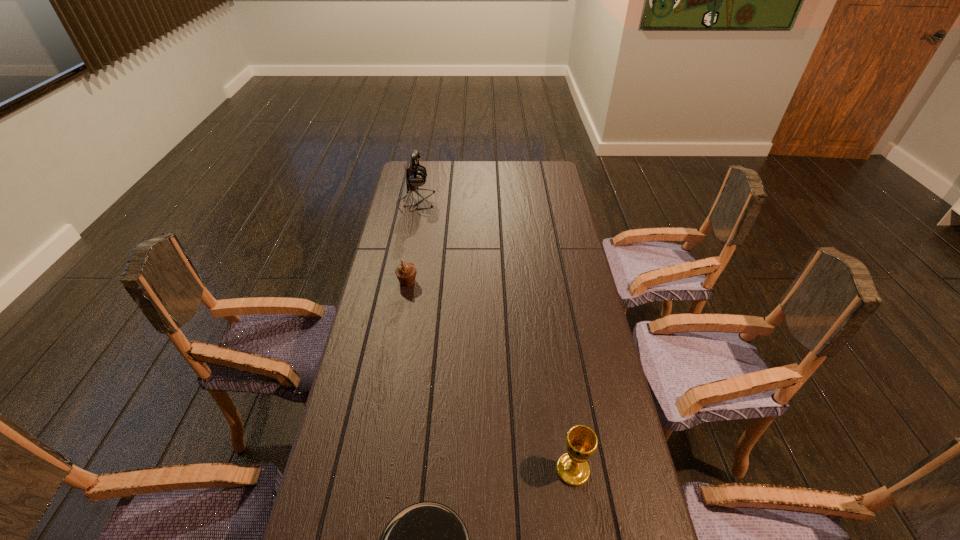
Where is `free area in between the tallest object and the chalice`? free area in between the tallest object and the chalice is located at coordinates (494, 335).

Identify the location of unoccupied area between the tallest object and the second shortest object. (412, 242).

Choose which object is the second nearest neighbor to the shortest object. Please provide its 2D coordinates. Your answer should be formatted as a tuple, i.e. [(x, y)], where the tuple contains the x and y coordinates of a point satisfying the conditions above.

[(406, 272)]

Identify which object is located as the second nearest to the farthest object. Please provide its 2D coordinates. Your answer should be formatted as a tuple, i.e. [(x, y)], where the tuple contains the x and y coordinates of a point satisfying the conditions above.

[(572, 467)]

Identify the location of vacant space that satisfies the following two spatial constraints: 1. on the front side of the tallest object; 2. on the left side of the chalice. The image size is (960, 540). click(364, 470).